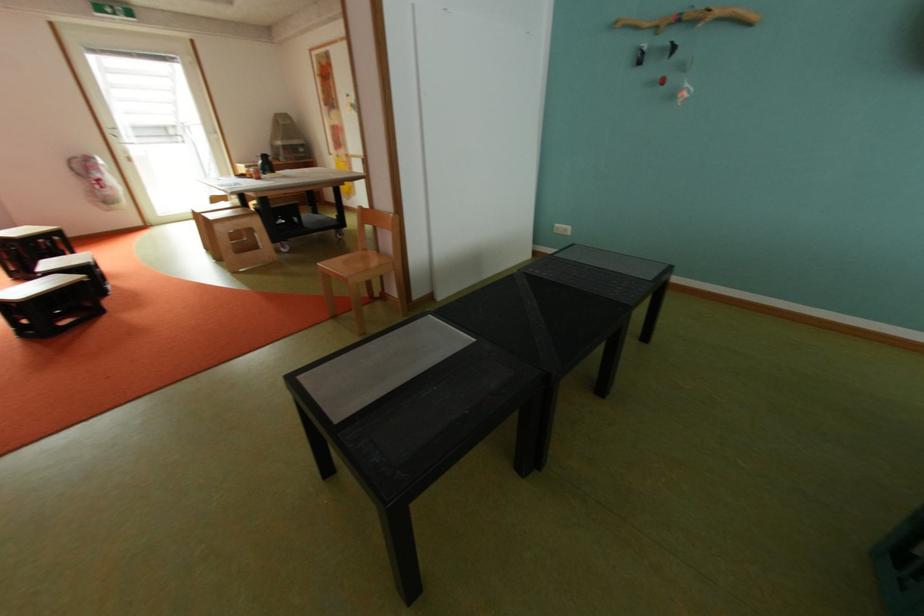
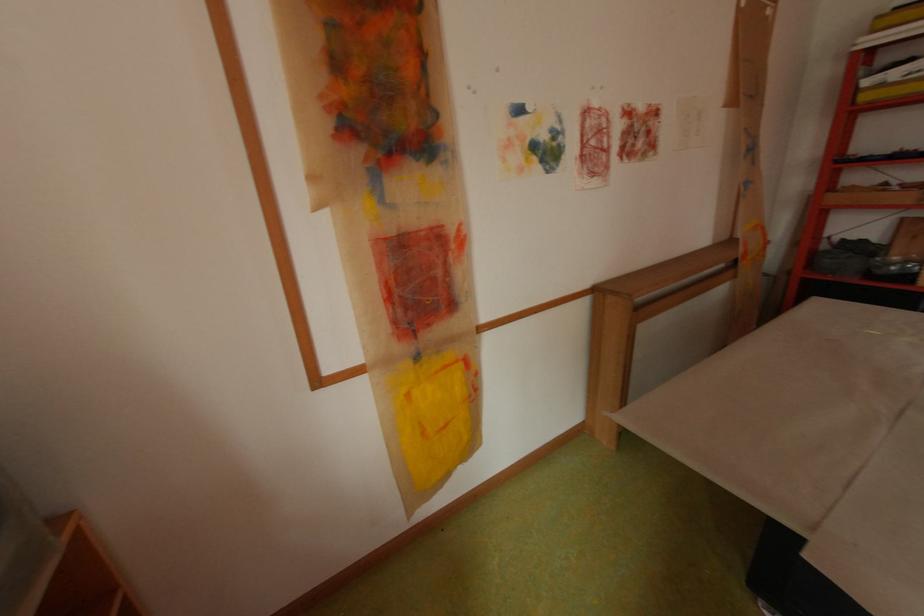
Where in the second image is the point corresponding to (347,156) from the first image?

(429, 358)